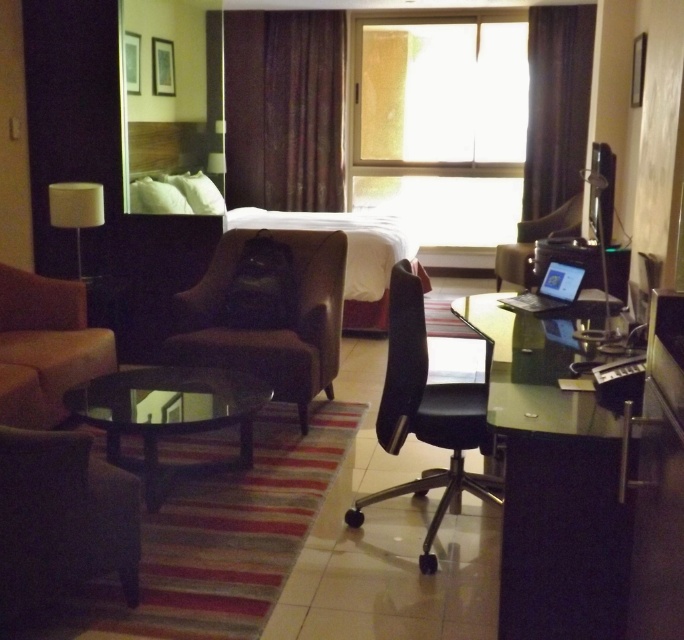
Question: Which of the following is the closest to the observer?

Choices:
 (A) (21, 404)
 (B) (540, 435)
 (C) (34, 560)

Answer: (B)

Question: Can you confirm if dark brown leather swivel chair at lower left is smaller than brown fabric curtain at upper right?

Choices:
 (A) yes
 (B) no

Answer: (A)

Question: Observing the image, what is the correct spatial positioning of dark brown leather swivel chair at lower left in reference to transparent glass table at center?

Choices:
 (A) below
 (B) above

Answer: (A)

Question: Does dark brown leather swivel chair at lower left lie in front of dark brown leather armchair at center?

Choices:
 (A) yes
 (B) no

Answer: (A)

Question: Which of the following is the farthest from the observer?

Choices:
 (A) (55, 301)
 (B) (521, 161)

Answer: (B)

Question: Based on their relative distances, which object is nearer to the brown velvet curtain at upper center?

Choices:
 (A) beige fabric couch at lower left
 (B) transparent glass table at center
 (C) silver metallic laptop at right

Answer: (A)